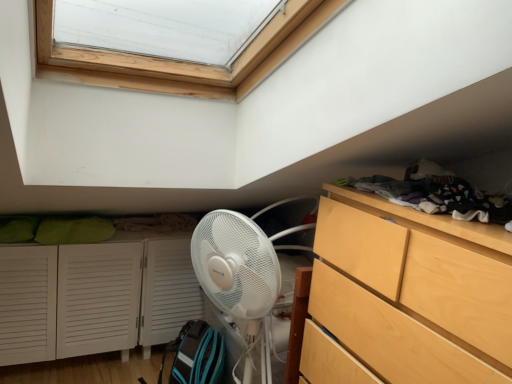
Question: Looking at their shapes, would you say light wood/texture chest of drawers at right is wider or thinner than dark gray fabric at upper right?

Choices:
 (A) thin
 (B) wide

Answer: (B)

Question: From a real-world perspective, is light wood/texture chest of drawers at right above or below dark gray fabric at upper right?

Choices:
 (A) below
 (B) above

Answer: (A)

Question: Based on their relative distances, which object is nearer to the white louvered cabinet at lower left?

Choices:
 (A) dark gray fabric at upper right
 (B) light wood/texture chest of drawers at right

Answer: (B)

Question: Considering the real-world distances, which object is closest to the dark gray fabric at upper right?

Choices:
 (A) light wood/texture chest of drawers at right
 (B) white louvered cabinet at lower left

Answer: (A)